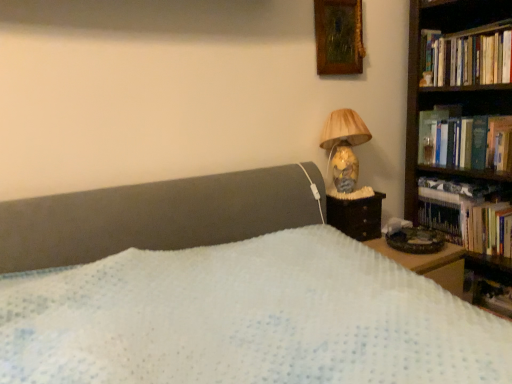
Question: Is there a large distance between wooden bookshelf at right and hardcover books at right, positioned as the 1th book in top-to-bottom order?

Choices:
 (A) yes
 (B) no

Answer: (B)

Question: Considering the relative positions of wooden bookshelf at right and hardcover books at right, positioned as the 1th book in top-to-bottom order, in the image provided, is wooden bookshelf at right to the left of hardcover books at right, positioned as the 1th book in top-to-bottom order, from the viewer's perspective?

Choices:
 (A) yes
 (B) no

Answer: (B)

Question: Can you confirm if wooden bookshelf at right is thinner than hardcover books at right, which is the third book in bottom-to-top order?

Choices:
 (A) no
 (B) yes

Answer: (A)

Question: Is wooden bookshelf at right facing towards hardcover books at right, positioned as the 1th book in top-to-bottom order?

Choices:
 (A) yes
 (B) no

Answer: (B)

Question: Is wooden bookshelf at right bigger than hardcover books at right, which is the third book in bottom-to-top order?

Choices:
 (A) yes
 (B) no

Answer: (A)

Question: Based on their sizes in the image, would you say hardcover books at right, which ranks as the third book in top-to-bottom order, is bigger or smaller than hardcover book at right, which appears as the 2th book when ordered from the bottom?

Choices:
 (A) big
 (B) small

Answer: (A)

Question: Is hardcover books at right, which appears as the first book when ordered from the bottom, in front of or behind hardcover book at right, which appears as the 2th book when ordered from the bottom, in the image?

Choices:
 (A) front
 (B) behind

Answer: (B)

Question: In terms of width, does hardcover books at right, which ranks as the third book in top-to-bottom order, look wider or thinner when compared to hardcover book at right, positioned as the second book in top-to-bottom order?

Choices:
 (A) thin
 (B) wide

Answer: (B)

Question: Is hardcover books at right, which appears as the first book when ordered from the bottom, situated inside hardcover book at right, which appears as the 2th book when ordered from the bottom, or outside?

Choices:
 (A) outside
 (B) inside

Answer: (A)

Question: Is hardcover books at right, positioned as the 1th book in top-to-bottom order, spatially inside hardcover book at upper right, or outside of it?

Choices:
 (A) inside
 (B) outside

Answer: (B)

Question: Is point (456, 44) positioned closer to the camera than point (442, 115)?

Choices:
 (A) farther
 (B) closer

Answer: (B)

Question: Based on their positions, is hardcover books at right, which is the third book in bottom-to-top order, located to the left or right of hardcover book at upper right?

Choices:
 (A) right
 (B) left

Answer: (A)

Question: Based on their sizes in the image, would you say hardcover books at right, which is the third book in bottom-to-top order, is bigger or smaller than hardcover book at upper right?

Choices:
 (A) big
 (B) small

Answer: (A)

Question: From the image's perspective, is hardcover book at upper right above or below hardcover book at right, which appears as the 2th book when ordered from the bottom?

Choices:
 (A) above
 (B) below

Answer: (A)

Question: Does point (433, 135) appear closer or farther from the camera than point (448, 165)?

Choices:
 (A) closer
 (B) farther

Answer: (B)